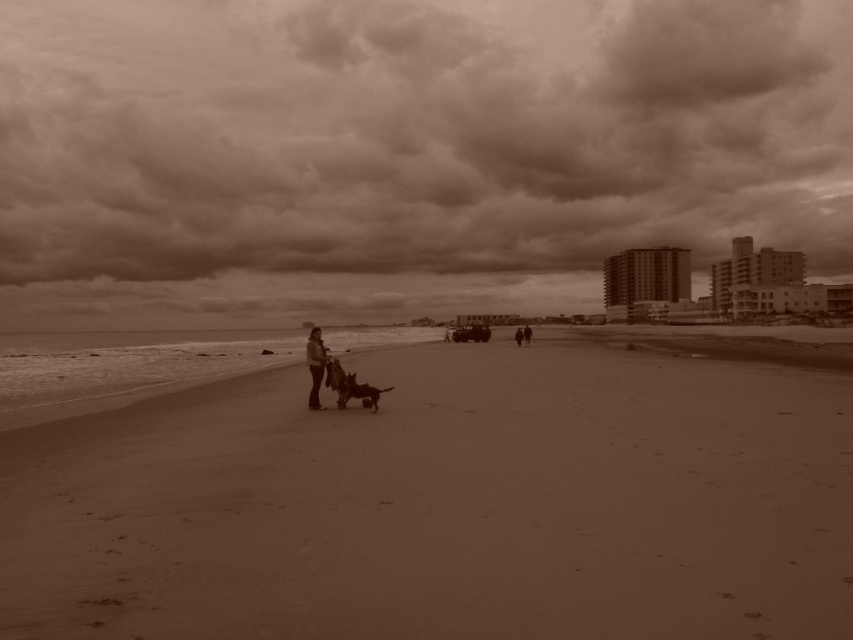
You are standing at the point marked by the coordinates point [444,504]. Based on the scene described, what type of terrain are you currently standing on?

The point [444,504] is on smooth sand at center, so you are standing on smooth sand.

You are standing on the beach and see the smooth sand at center and the dark brown leather jacket at center. Which object is closer to you?

The smooth sand at center is closer to you because it is in front of the dark brown leather jacket at center.

You are standing at the camera position and want to reach the point marked at coordinates (238, 180). If you walk directly towards it, how far will you have to walk in meters?

You will have to walk 208.29 meters to reach the point marked at coordinates (238, 180) from the camera position.